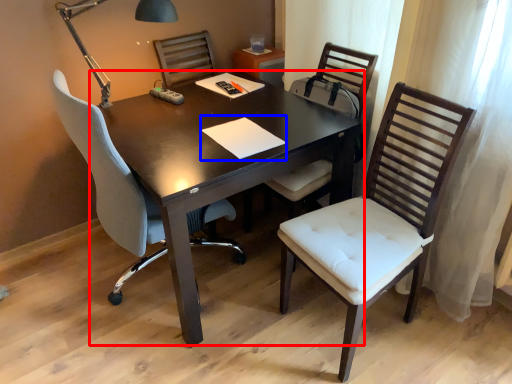
Question: Which of the following is the closest to the observer, table (highlighted by a red box) or notepad (highlighted by a blue box)?

Choices:
 (A) table
 (B) notepad

Answer: (A)